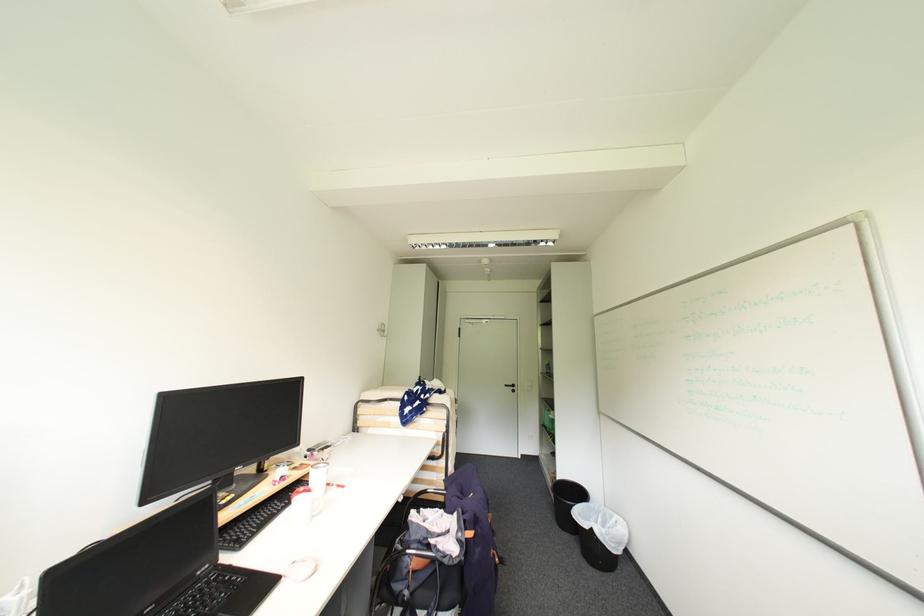
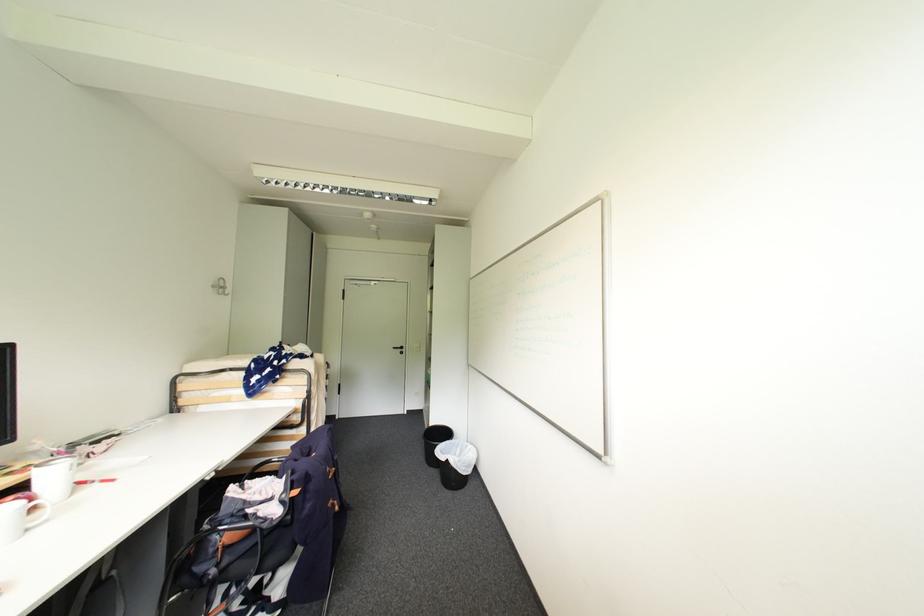
Find the pixel in the second image that matches pixel 513 387 in the first image.

(400, 349)